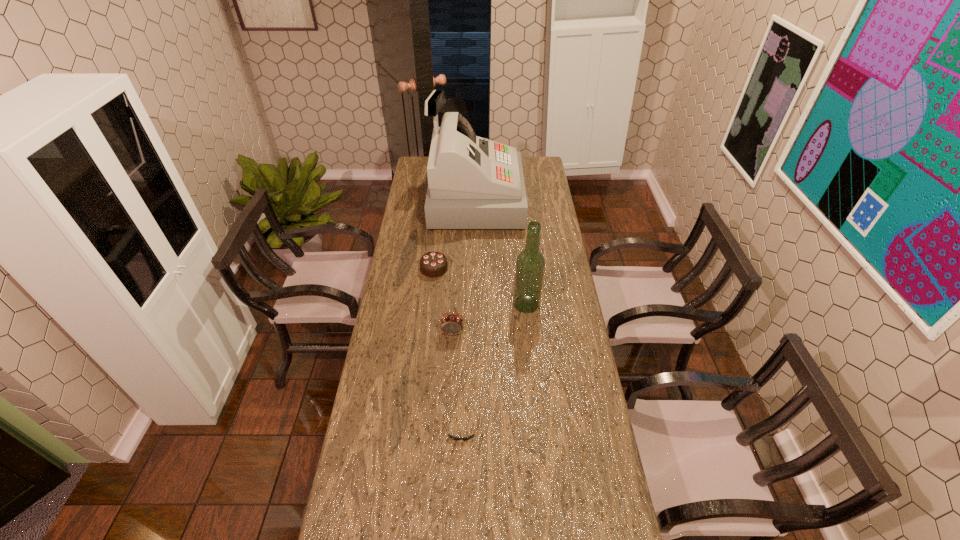
Find the location of `the tallest object`. the tallest object is located at coordinates (473, 183).

Where is `cash register`? cash register is located at coordinates (473, 183).

Where is `the second tallest object`? the second tallest object is located at coordinates (530, 264).

Where is `liquor`? liquor is located at coordinates (530, 264).

Where is `the fourth shortest object`? The width and height of the screenshot is (960, 540). the fourth shortest object is located at coordinates (451, 324).

Identify the location of the third nearest object. (451, 324).

Find the location of a particular element. The image size is (960, 540). the second farthest object is located at coordinates [434, 264].

You are a GUI agent. You are given a task and a screenshot of the screen. Output one action in this format:
    pyautogui.click(x=<x>, y=<y>)
    Task: Click on the fourth tallest object
    Image resolution: width=960 pixels, height=540 pixels.
    Given the screenshot: What is the action you would take?
    pyautogui.click(x=434, y=264)

Find the location of `sunglasses`. sunglasses is located at coordinates (471, 436).

Locate an element on the screen. The height and width of the screenshot is (540, 960). the second nearest object is located at coordinates (471, 436).